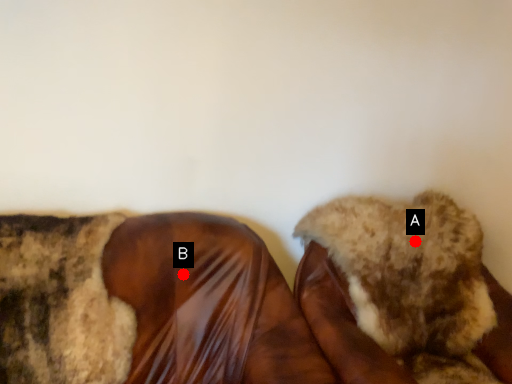
Question: Two points are circled on the image, labeled by A and B beside each circle. Which point is closer to the camera taking this photo?

Choices:
 (A) A is closer
 (B) B is closer

Answer: (B)